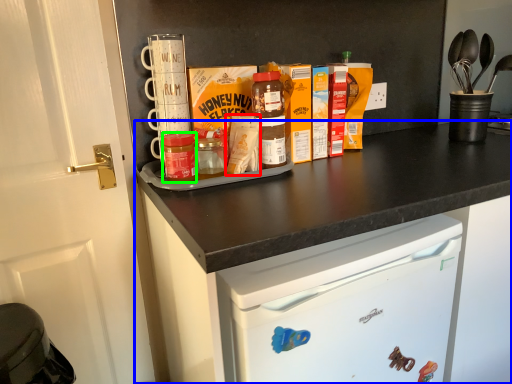
Question: Considering the real-world distances, which object is closest to cereal (highlighted by a red box)? cabinetry (highlighted by a blue box) or bottle (highlighted by a green box).

Choices:
 (A) cabinetry
 (B) bottle

Answer: (B)